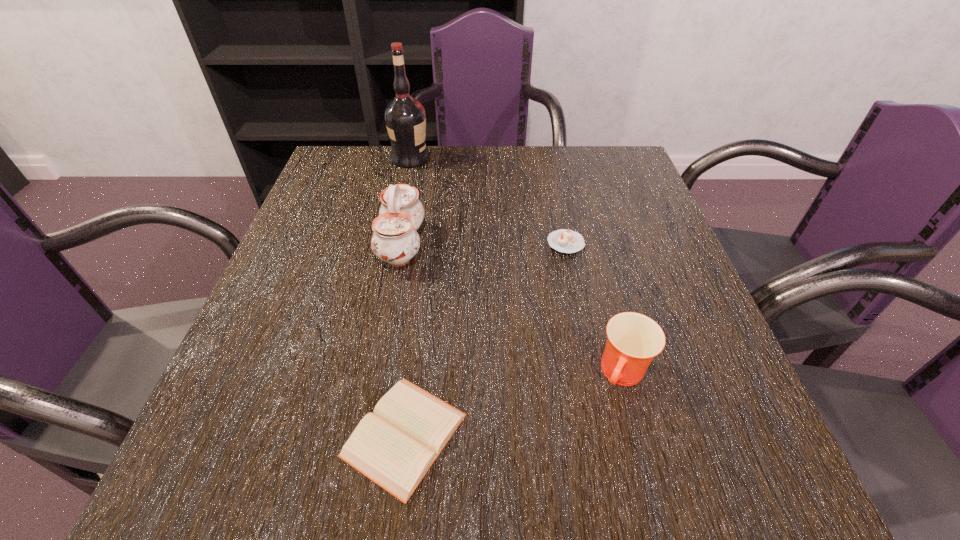
This screenshot has height=540, width=960. Find the location of `vacant area between the cupcake and the farthest object`. vacant area between the cupcake and the farthest object is located at coordinates (488, 200).

This screenshot has height=540, width=960. Identify the location of unoccupied position between the third tallest object and the tallest object. (516, 266).

Where is `vacant space in between the liquor and the third shortest object`? Image resolution: width=960 pixels, height=540 pixels. vacant space in between the liquor and the third shortest object is located at coordinates (516, 266).

Identify the location of empty space between the second shortest object and the chinaware. (484, 244).

At what (x,y) coordinates should I click in order to perform the action: click on vacant space that is in between the chinaware and the cup. Please return your answer as a coordinate pair (x, y). Looking at the image, I should click on (513, 309).

The width and height of the screenshot is (960, 540). I want to click on vacant space that's between the shortest object and the cup, so click(x=514, y=404).

Where is `vacant area that lies between the shortest object and the chinaware`? This screenshot has height=540, width=960. vacant area that lies between the shortest object and the chinaware is located at coordinates (403, 340).

Image resolution: width=960 pixels, height=540 pixels. Find the location of `vacant area that lies between the shortest object and the chinaware`. vacant area that lies between the shortest object and the chinaware is located at coordinates (403, 340).

Locate an element on the screen. object that ranks as the third closest to the third shortest object is located at coordinates (395, 240).

Locate an element on the screen. object that is the third closest to the second tallest object is located at coordinates (563, 240).